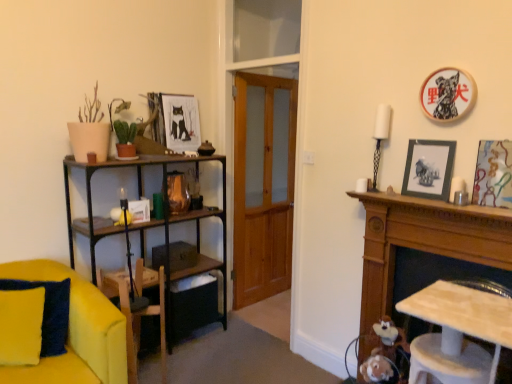
You are a GUI agent. You are given a task and a screenshot of the screen. Output one action in this format:
    pyautogui.click(x=<x>, y=<y>)
    Task: Click on the brown wooden mantle at upper right
    The image size is (512, 384).
    Given the screenshot: What is the action you would take?
    pyautogui.click(x=434, y=205)

Is metallic silver picture frame at right, acting as the 4th picture frame starting from the back, positioned with its back to black glossy picture frame at upper right, placed as the third picture frame when sorted from left to right?

No, metallic silver picture frame at right, acting as the 4th picture frame starting from the back, is not facing the opposite direction of black glossy picture frame at upper right, placed as the third picture frame when sorted from left to right.

Is metallic silver picture frame at right, acting as the 4th picture frame starting from the back, outside of black glossy picture frame at upper right, positioned as the third picture frame in back-to-front order?

Yes, metallic silver picture frame at right, acting as the 4th picture frame starting from the back, is not within black glossy picture frame at upper right, positioned as the third picture frame in back-to-front order.

Can you confirm if metallic silver picture frame at right, arranged as the fourth picture frame when viewed from the left, is wider than black glossy picture frame at upper right, which is the 2th picture frame from front to back?

In fact, metallic silver picture frame at right, arranged as the fourth picture frame when viewed from the left, might be narrower than black glossy picture frame at upper right, which is the 2th picture frame from front to back.

Based on the photo, how distant is metallic silver picture frame at right, acting as the 4th picture frame starting from the back, from black glossy picture frame at upper right, placed as the third picture frame when sorted from left to right?

metallic silver picture frame at right, acting as the 4th picture frame starting from the back, is 11.55 inches away from black glossy picture frame at upper right, placed as the third picture frame when sorted from left to right.

Would you consider brown wooden mantle at upper right to be distant from wooden mantelpiece at right?

That's not correct — brown wooden mantle at upper right is a little close to wooden mantelpiece at right.

Could you tell me if brown wooden mantle at upper right is turned towards wooden mantelpiece at right?

No.

From a real-world perspective, is brown wooden mantle at upper right on top of wooden mantelpiece at right?

Yes.

Looking at this image, could you tell me if matte black picture frame at upper right, the second picture frame when ordered from back to front, is facing metallic silver picture frame at right, which appears as the 1th picture frame when viewed from the front?

No, matte black picture frame at upper right, the second picture frame when ordered from back to front, is not facing towards metallic silver picture frame at right, which appears as the 1th picture frame when viewed from the front.

Where is `the 2nd picture frame behind the metallic silver picture frame at right, placed as the first picture frame when sorted from right to left, starting your count from the anchor`? the 2nd picture frame behind the metallic silver picture frame at right, placed as the first picture frame when sorted from right to left, starting your count from the anchor is located at coordinates (429, 169).

From the picture: Which of these two, matte black picture frame at upper right, which is the 2th picture frame from left to right, or metallic silver picture frame at right, which appears as the 1th picture frame when viewed from the front, stands shorter?

matte black picture frame at upper right, which is the 2th picture frame from left to right.

Who is smaller, matte black picture frame at upper right, which ranks as the third picture frame in right-to-left order, or metallic silver picture frame at right, acting as the 4th picture frame starting from the back?

Smaller between the two is metallic silver picture frame at right, acting as the 4th picture frame starting from the back.

Is wooden mantelpiece at right to the left or to the right of matte paper picture frame at upper center, which appears as the first picture frame when viewed from the back, in the image?

wooden mantelpiece at right is positioned on matte paper picture frame at upper center, which appears as the first picture frame when viewed from the back,'s right side.

Is wooden mantelpiece at right spatially inside matte paper picture frame at upper center, which appears as the fourth picture frame when viewed from the front, or outside of it?

wooden mantelpiece at right cannot be found inside matte paper picture frame at upper center, which appears as the fourth picture frame when viewed from the front.

Looking at the image, does wooden mantelpiece at right seem bigger or smaller compared to matte paper picture frame at upper center, arranged as the first picture frame when viewed from the left?

Clearly, wooden mantelpiece at right is larger in size than matte paper picture frame at upper center, arranged as the first picture frame when viewed from the left.

In the scene shown: Is wooden mantelpiece at right wider than matte paper picture frame at upper center, which appears as the first picture frame when viewed from the back?

Indeed, wooden mantelpiece at right has a greater width compared to matte paper picture frame at upper center, which appears as the first picture frame when viewed from the back.

Which is correct: brown wooden mantle at upper right is inside metallic silver picture frame at right, arranged as the fourth picture frame when viewed from the left, or outside of it?

brown wooden mantle at upper right lies outside metallic silver picture frame at right, arranged as the fourth picture frame when viewed from the left.

The width and height of the screenshot is (512, 384). Find the location of `mantle in front of the metallic silver picture frame at right, which appears as the 1th picture frame when viewed from the front`. mantle in front of the metallic silver picture frame at right, which appears as the 1th picture frame when viewed from the front is located at coordinates (434, 205).

In the image, is brown wooden mantle at upper right on the left side or the right side of metallic silver picture frame at right, arranged as the fourth picture frame when viewed from the left?

Based on their positions, brown wooden mantle at upper right is located to the left of metallic silver picture frame at right, arranged as the fourth picture frame when viewed from the left.

From the image's perspective, is brown wooden mantle at upper right located beneath metallic silver picture frame at right, acting as the 4th picture frame starting from the back?

Correct, brown wooden mantle at upper right appears lower than metallic silver picture frame at right, acting as the 4th picture frame starting from the back, in the image.

Could you tell me if matte black picture frame at upper right, which is the third picture frame in front-to-back order, is facing matte paper picture frame at upper center, arranged as the first picture frame when viewed from the left?

No, matte black picture frame at upper right, which is the third picture frame in front-to-back order, is not aimed at matte paper picture frame at upper center, arranged as the first picture frame when viewed from the left.

From the image's perspective, is matte black picture frame at upper right, which is the third picture frame in front-to-back order, beneath matte paper picture frame at upper center, which is the fourth picture frame in right-to-left order?

Indeed, from the image's perspective, matte black picture frame at upper right, which is the third picture frame in front-to-back order, is shown beneath matte paper picture frame at upper center, which is the fourth picture frame in right-to-left order.

From a real-world perspective, between matte black picture frame at upper right, which is the third picture frame in front-to-back order, and matte paper picture frame at upper center, which is the fourth picture frame in right-to-left order, who is vertically higher?

matte paper picture frame at upper center, which is the fourth picture frame in right-to-left order, from a real-world perspective.

Is brown wooden mantle at upper right positioned with its back to matte black picture frame at upper right, the second picture frame when ordered from back to front?

That's not correct — brown wooden mantle at upper right is not looking away from matte black picture frame at upper right, the second picture frame when ordered from back to front.

Can you confirm if brown wooden mantle at upper right is taller than matte black picture frame at upper right, the second picture frame when ordered from back to front?

Incorrect, the height of brown wooden mantle at upper right is not larger of that of matte black picture frame at upper right, the second picture frame when ordered from back to front.

From the metallic silver picture frame at right, placed as the first picture frame when sorted from right to left, count the 1st picture frame to the left and point to it. Please provide its 2D coordinates.

[(447, 94)]

Where is `cabinetry that is behind the brown wooden mantle at upper right`? This screenshot has width=512, height=384. cabinetry that is behind the brown wooden mantle at upper right is located at coordinates coord(424,243).

Estimate the real-world distances between objects in this image. Which object is closer to black glossy picture frame at upper right, positioned as the third picture frame in back-to-front order, brown wooden mantle at upper right or yellow fabric cushion at lower left?

brown wooden mantle at upper right is positioned closer to the anchor black glossy picture frame at upper right, positioned as the third picture frame in back-to-front order.

From the picture: Looking at the image, which one is located further to wooden mantelpiece at right, matte paper picture frame at upper center, which is the fourth picture frame in right-to-left order, or black glossy picture frame at upper right, the second picture frame from the right?

The object further to wooden mantelpiece at right is matte paper picture frame at upper center, which is the fourth picture frame in right-to-left order.

Looking at the image, which one is located further to matte paper picture frame at upper center, which is the fourth picture frame in right-to-left order, metallic silver picture frame at right, acting as the 4th picture frame starting from the back, or wooden armchair at lower left?

metallic silver picture frame at right, acting as the 4th picture frame starting from the back, is positioned further to the anchor matte paper picture frame at upper center, which is the fourth picture frame in right-to-left order.

From the image, which object appears to be farther from metallic silver picture frame at right, placed as the first picture frame when sorted from right to left, wooden armchair at lower left or matte paper picture frame at upper center, which is the fourth picture frame in right-to-left order?

matte paper picture frame at upper center, which is the fourth picture frame in right-to-left order.

When comparing their distances from yellow fabric cushion at lower left, does metallic silver picture frame at right, placed as the first picture frame when sorted from right to left, or wooden armchair at lower left seem further?

metallic silver picture frame at right, placed as the first picture frame when sorted from right to left.

Estimate the real-world distances between objects in this image. Which object is further from metallic silver picture frame at right, arranged as the fourth picture frame when viewed from the left, black glossy picture frame at upper right, positioned as the third picture frame in back-to-front order, or yellow fabric cushion at lower left?

yellow fabric cushion at lower left.

Which object lies further to the anchor point metallic silver picture frame at right, arranged as the fourth picture frame when viewed from the left, brown wooden mantle at upper right or yellow fabric cushion at lower left?

yellow fabric cushion at lower left lies further to metallic silver picture frame at right, arranged as the fourth picture frame when viewed from the left, than the other object.

Based on the photo, which object lies further to the anchor point wooden armchair at lower left, metallic silver picture frame at right, arranged as the fourth picture frame when viewed from the left, or black glossy picture frame at upper right, placed as the third picture frame when sorted from left to right?

Based on the image, black glossy picture frame at upper right, placed as the third picture frame when sorted from left to right, appears to be further to wooden armchair at lower left.

Where is `picture frame between yellow fabric cushion at lower left and matte black picture frame at upper right, which is the 2th picture frame from left to right, in the horizontal direction`? picture frame between yellow fabric cushion at lower left and matte black picture frame at upper right, which is the 2th picture frame from left to right, in the horizontal direction is located at coordinates (181, 122).

At what (x,y) coordinates should I click in order to perform the action: click on cabinetry between yellow fabric cushion at lower left and metallic silver picture frame at right, arranged as the fourth picture frame when viewed from the left, from left to right. Please return your answer as a coordinate pair (x, y). The image size is (512, 384). Looking at the image, I should click on (424, 243).

Where is `armchair between yellow fabric cushion at lower left and black glossy picture frame at upper right, which is the 2th picture frame from front to back, in the horizontal direction`? armchair between yellow fabric cushion at lower left and black glossy picture frame at upper right, which is the 2th picture frame from front to back, in the horizontal direction is located at coordinates (141, 316).

Where is `armchair situated between yellow fabric cushion at lower left and metallic silver picture frame at right, arranged as the fourth picture frame when viewed from the left, from left to right`? Image resolution: width=512 pixels, height=384 pixels. armchair situated between yellow fabric cushion at lower left and metallic silver picture frame at right, arranged as the fourth picture frame when viewed from the left, from left to right is located at coordinates (141, 316).